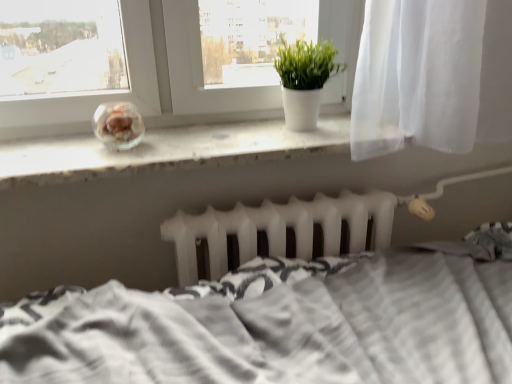
Find the location of a particular element. The width and height of the screenshot is (512, 384). free region under green matte plant at center (from a real-world perspective) is located at coordinates (305, 130).